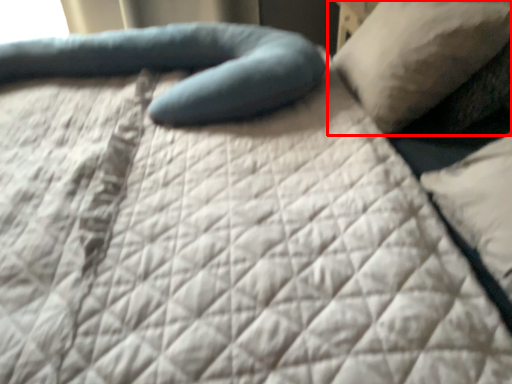
Question: From the image, what is the correct spatial relationship of pillow (annotated by the red box) in relation to pillow?

Choices:
 (A) right
 (B) left

Answer: (A)